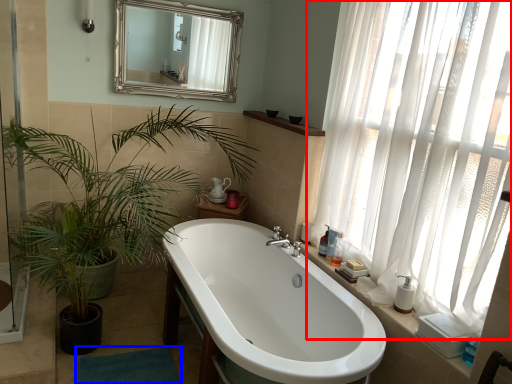
Question: Among these objects, which one is nearest to the camera, curtain (highlighted by a red box) or bath mat (highlighted by a blue box)?

Choices:
 (A) curtain
 (B) bath mat

Answer: (A)